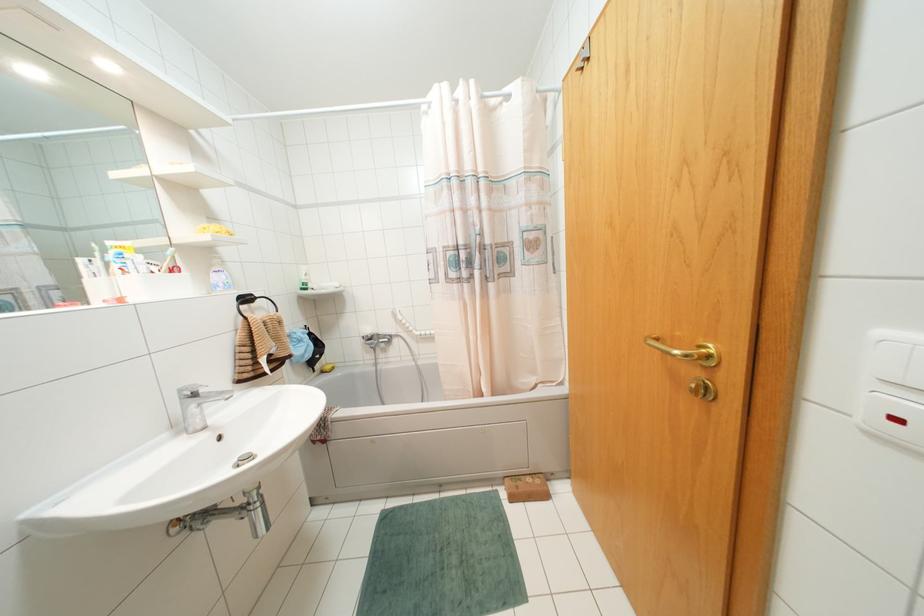
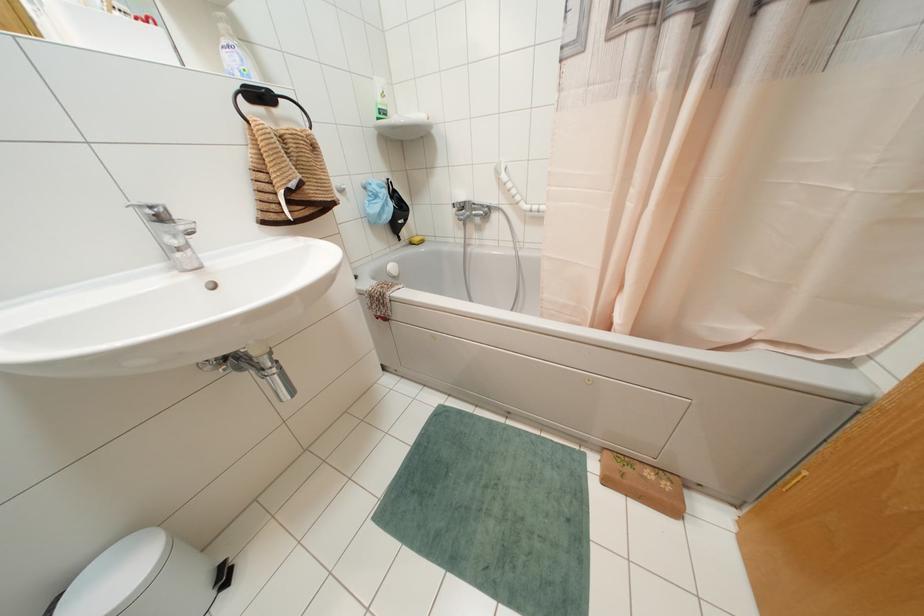
How did the camera likely rotate?

The camera rotated toward left-down.